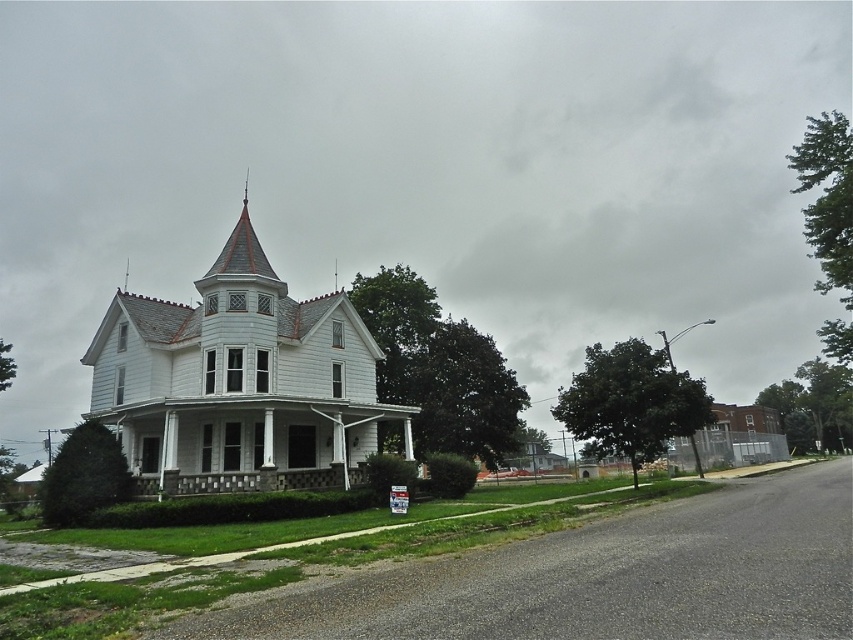
You are standing on the sidewalk in front of the Victorian house. You notice two points marked on the image. The first point is at coordinate point[169,355] and the second point is at point[238,488]. From your current position, which point is closer to you?

Point[238,488] is closer to you because it is in front of point[169,355] according to the description.

You are a painter hired to paint the exterior of the house. You need to estimate which area requires more paint between the white shingles at upper center and the white painted wood porch at center. Which area should you prioritize?

The white shingles at upper center should be prioritized because their width is greater than the white painted wood porch at center, meaning they cover a larger surface area and thus require more paint.